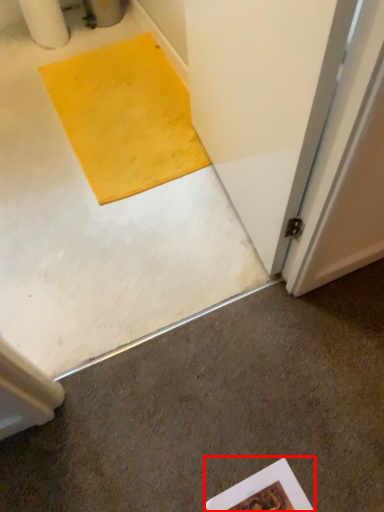
Question: From the image's perspective, what is the correct spatial relationship of writing (annotated by the red box) in relation to concrete?

Choices:
 (A) below
 (B) above

Answer: (A)